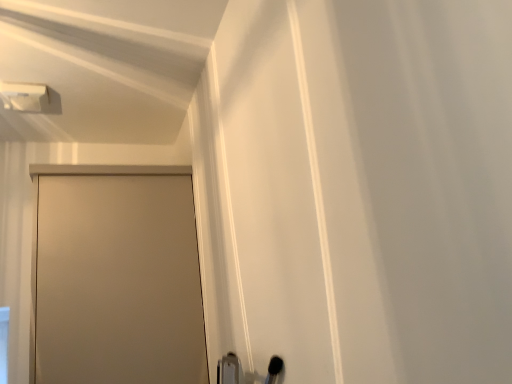
At what (x,y) coordinates should I click in order to perform the action: click on matte beige door at left. Please return your answer as a coordinate pair (x, y). Looking at the image, I should click on (118, 281).

Measure the distance between point (40,238) and camera.

5.20 feet.

What do you see at coordinates (118, 281) in the screenshot? The width and height of the screenshot is (512, 384). I see `matte beige door at left` at bounding box center [118, 281].

Where is `matte beige door at left`? The width and height of the screenshot is (512, 384). matte beige door at left is located at coordinates (118, 281).